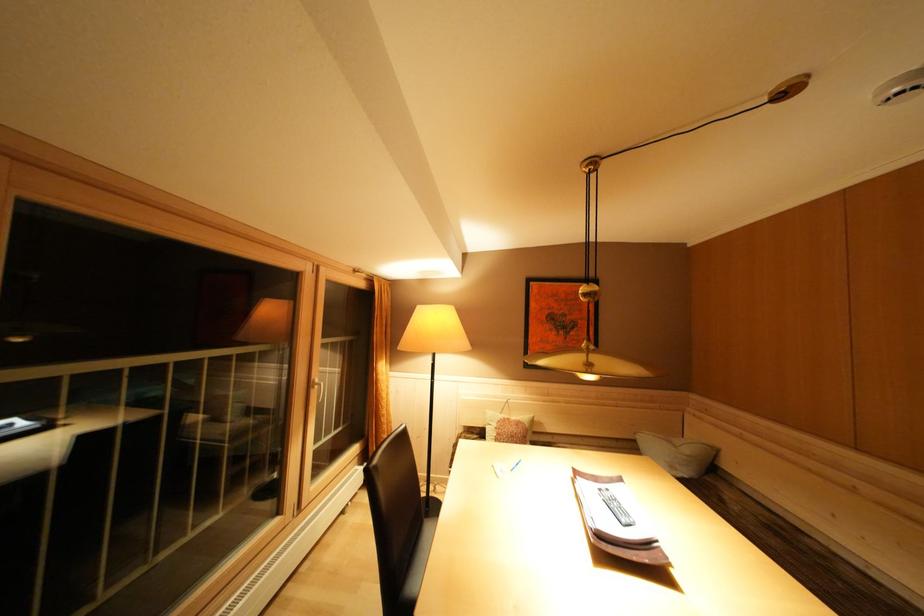
This screenshot has height=616, width=924. Identify the location of white door handle. (320, 394).